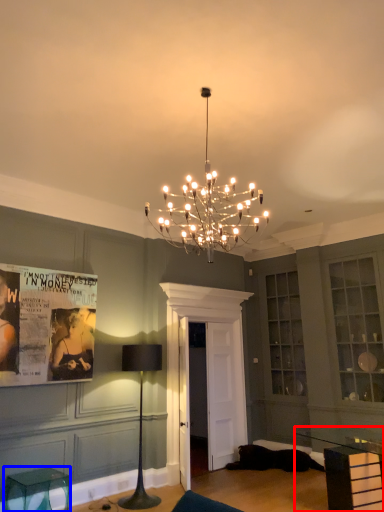
Question: Which object is closer to the camera taking this photo, table (highlighted by a red box) or furniture (highlighted by a blue box)?

Choices:
 (A) table
 (B) furniture

Answer: (A)